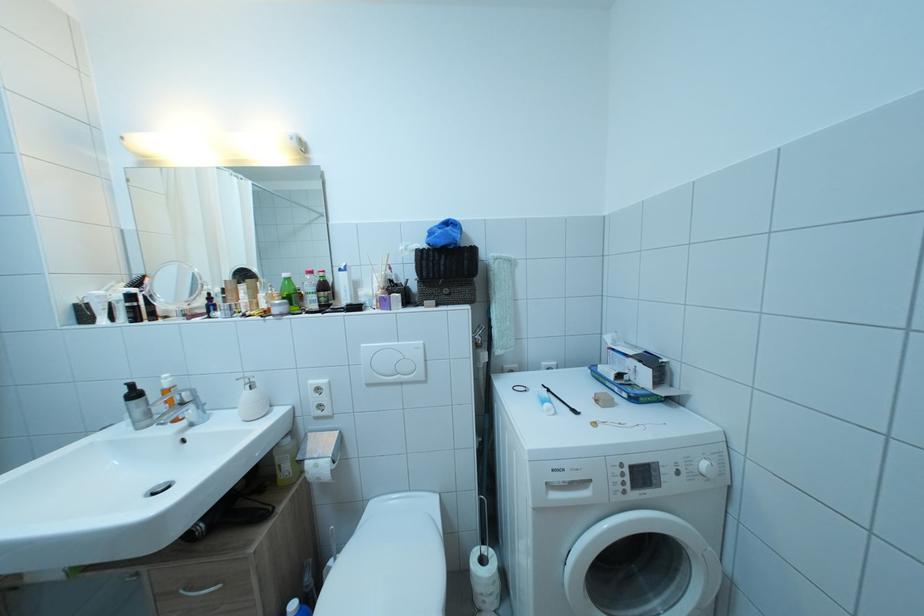
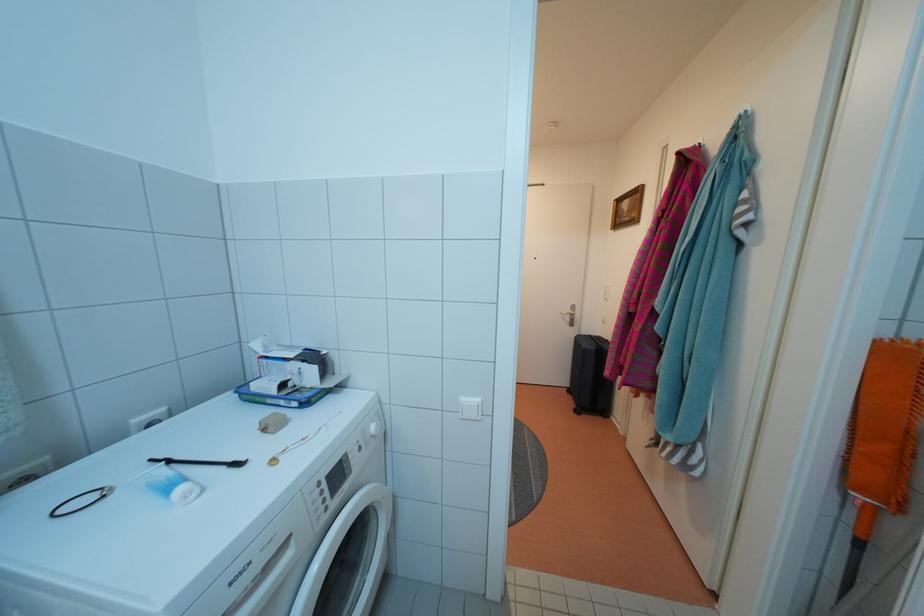
Question: The camera is either moving clockwise (left) or counter-clockwise (right) around the object. The first image is from the beginning of the video and the second image is from the end. Is the camera moving left or right when shooting the video?

Choices:
 (A) Left
 (B) Right

Answer: (A)